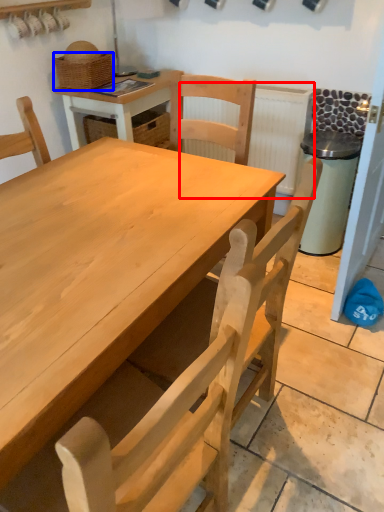
Question: Which object is closer to the camera taking this photo, radiator (highlighted by a red box) or basket (highlighted by a blue box)?

Choices:
 (A) radiator
 (B) basket

Answer: (B)